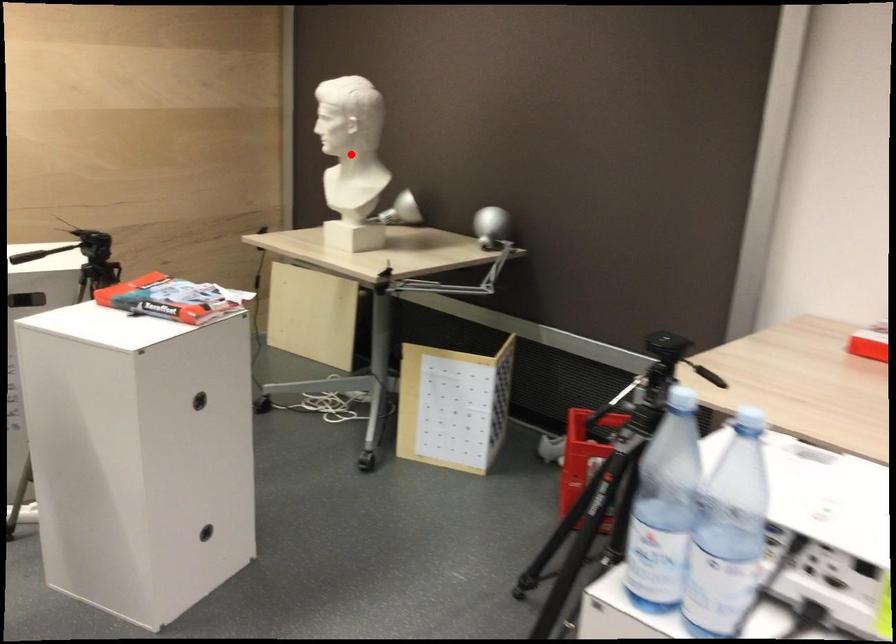
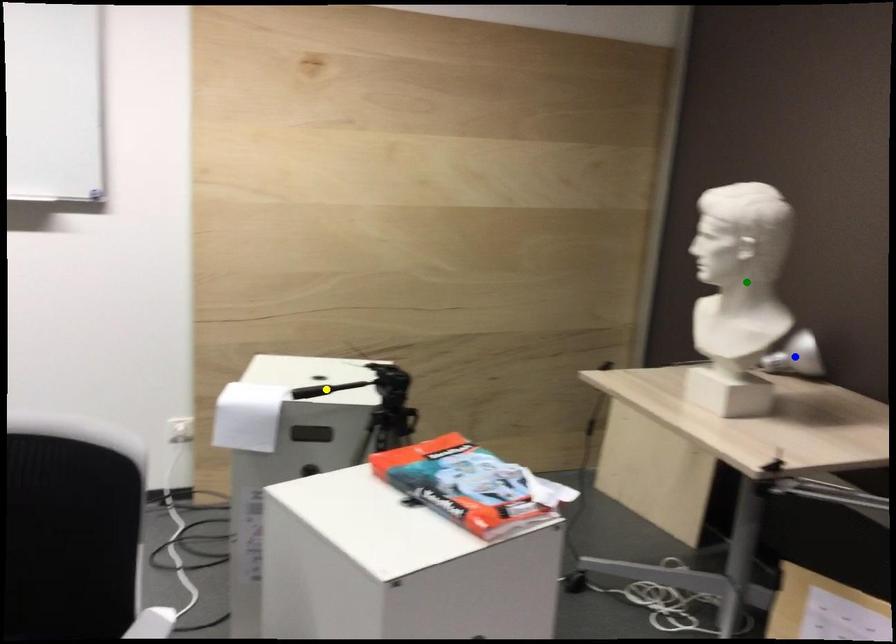
Question: I am providing you with two images of the same scene from different viewpoints. A red point is marked on the first image. You are given multiple points on the second image. Can you choose the point in image 2 that corresponds to the point in image 1?

Choices:
 (A) yellow point
 (B) blue point
 (C) green point

Answer: (C)